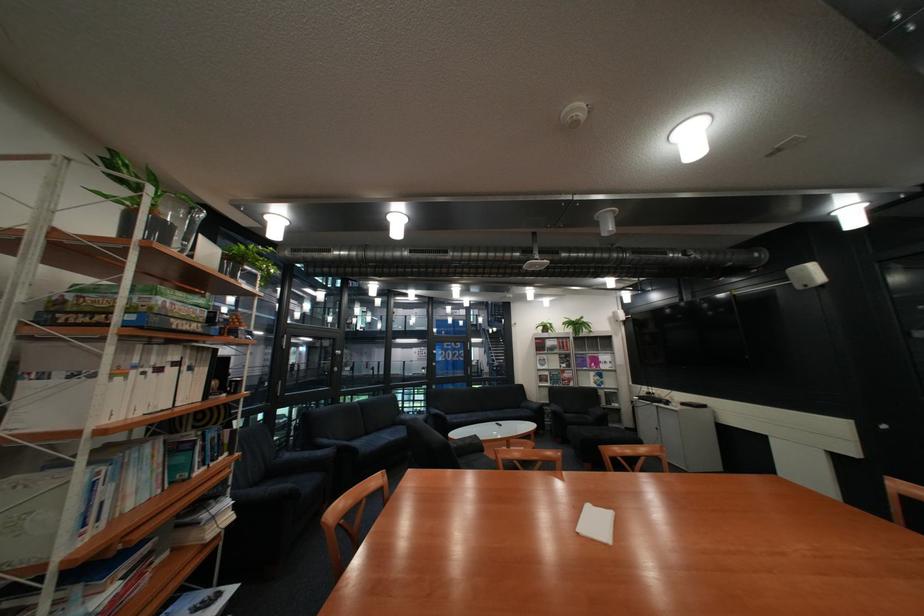
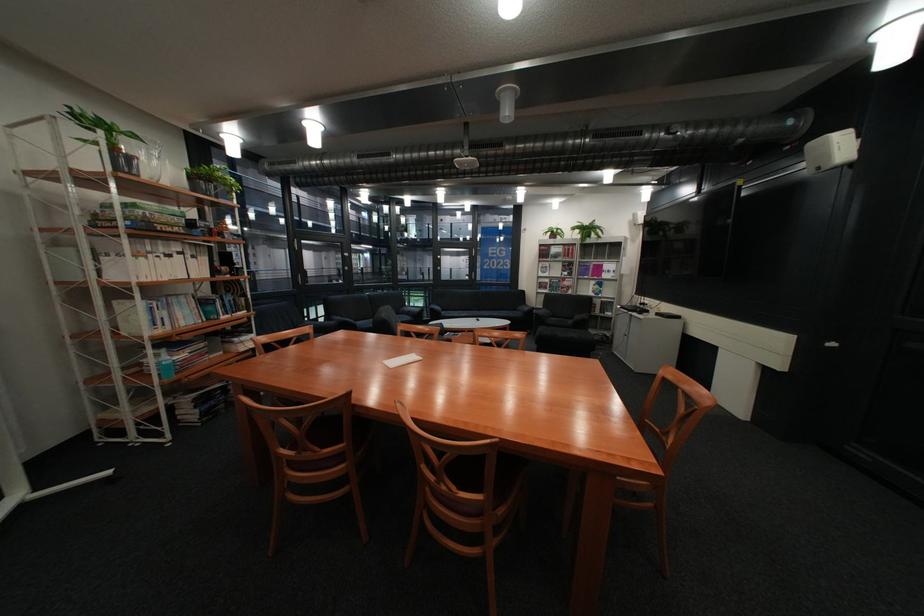
The point at (490, 418) is marked in the first image. Where is the corresponding point in the second image?

(481, 315)